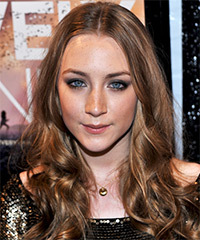
The width and height of the screenshot is (200, 240). What are the coordinates of `pendant` in the screenshot? It's located at tap(102, 191).